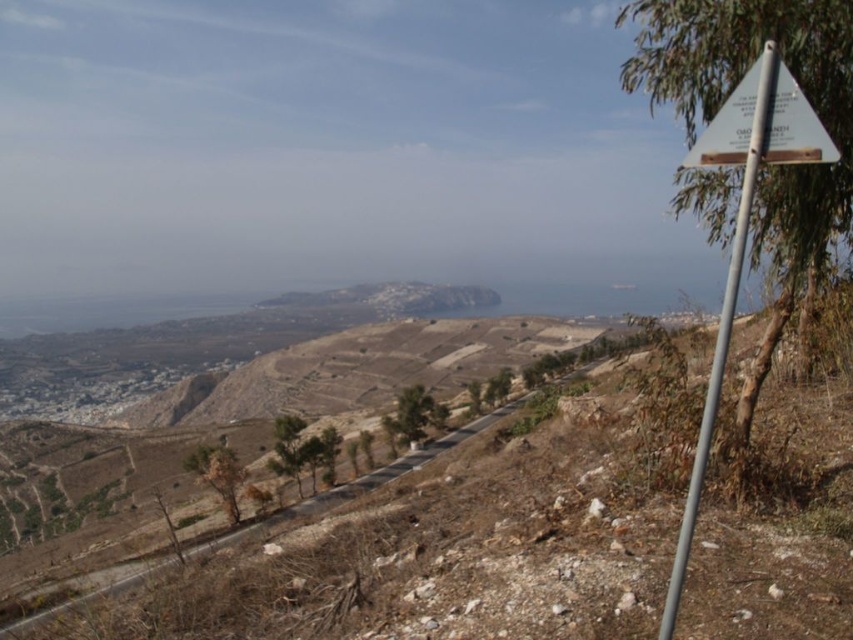
Question: Which object appears closest to the camera in this image?

Choices:
 (A) silver metallic signpost at right
 (B) dirt road at center
 (C) white plastic sign at upper right

Answer: (C)

Question: Which object is the closest to the silver metallic signpost at right?

Choices:
 (A) dirt road at center
 (B) white plastic sign at upper right

Answer: (B)

Question: Considering the relative positions of silver metallic signpost at right and dirt road at center in the image provided, where is silver metallic signpost at right located with respect to dirt road at center?

Choices:
 (A) above
 (B) below

Answer: (A)

Question: Does silver metallic signpost at right have a greater width compared to dirt road at center?

Choices:
 (A) no
 (B) yes

Answer: (A)

Question: In this image, where is white plastic sign at upper right located relative to silver metallic signpost at right?

Choices:
 (A) above
 (B) below

Answer: (A)

Question: Which point is farther to the camera?

Choices:
 (A) white plastic sign at upper right
 (B) dirt road at center
 (C) silver metallic signpost at right

Answer: (B)